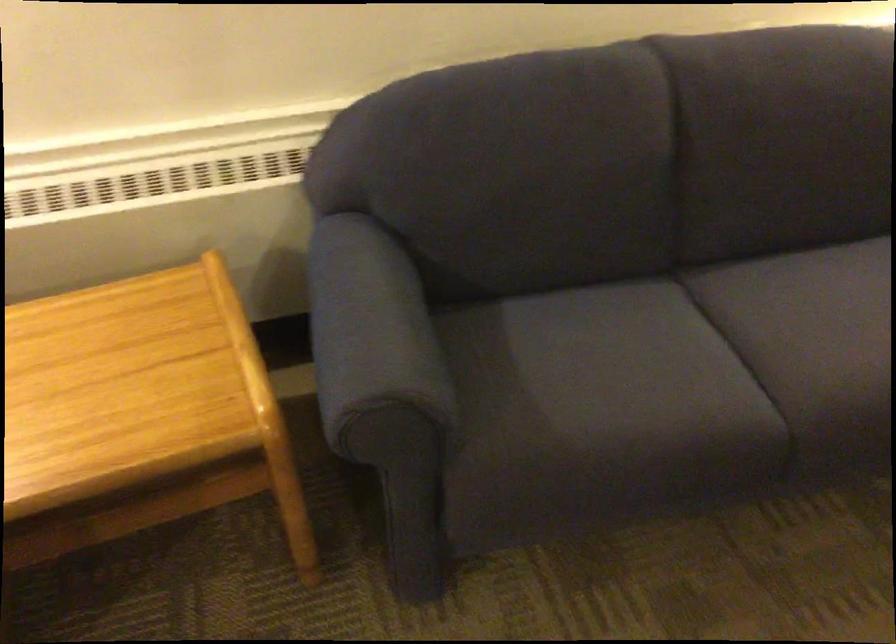
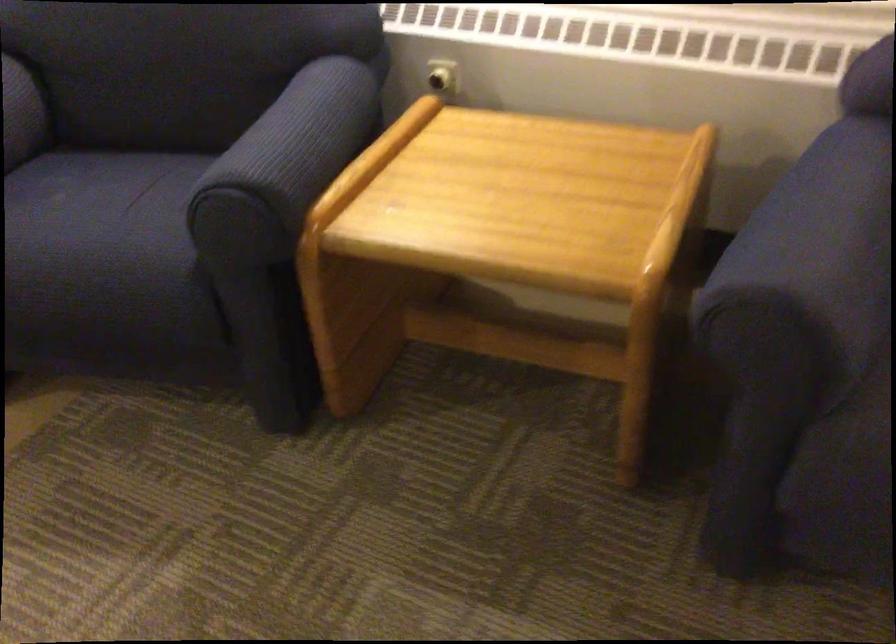
Locate, in the second image, the point that corresponds to point (392, 332) in the first image.

(821, 238)